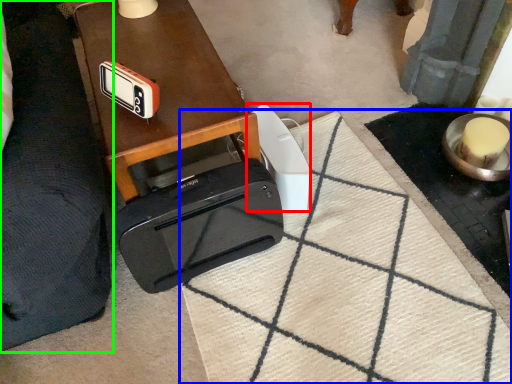
Question: Which object is positioned closest to gadget (highlighted by a red box)? Select from doormat (highlighted by a blue box) and furniture (highlighted by a green box).

Choices:
 (A) doormat
 (B) furniture

Answer: (A)